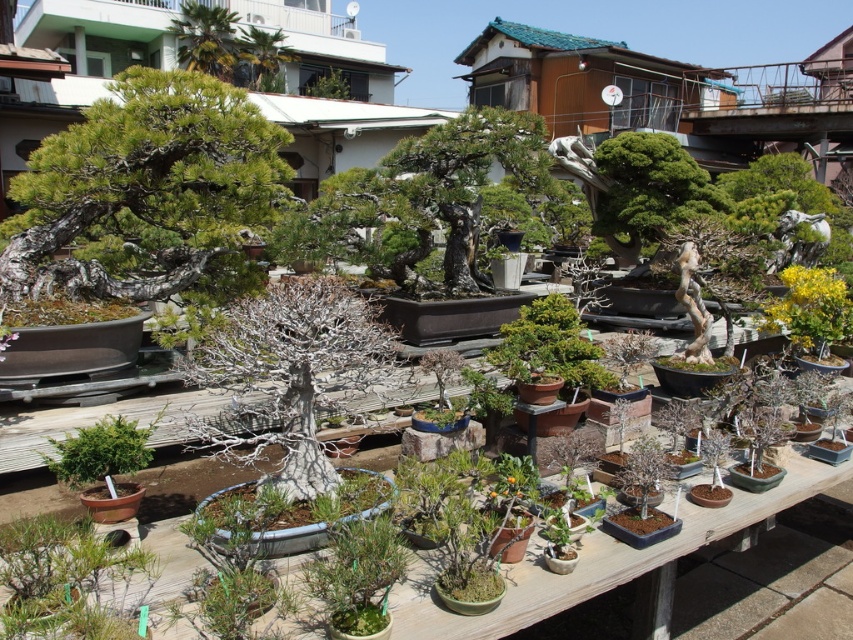
Question: Estimate the real-world distances between objects in this image. Which object is farther from the green matte bonsai tree at upper left?

Choices:
 (A) green glossy bonsai at upper right
 (B) green leafy tree at upper center

Answer: (B)

Question: Is green matte bonsai tree at upper left positioned before bare bark bonsai at center?

Choices:
 (A) no
 (B) yes

Answer: (A)

Question: Is bare bark bonsai at center thinner than green glossy bonsai at upper right?

Choices:
 (A) no
 (B) yes

Answer: (B)

Question: Which point is closer to the camera?

Choices:
 (A) (73, 141)
 (B) (277, 81)
 (C) (218, 32)

Answer: (A)

Question: Which of these objects is positioned farthest from the green leafy palm at upper center?

Choices:
 (A) green matte bonsai tree at center
 (B) green matte bonsai tree at upper left

Answer: (B)

Question: Can you confirm if bare bark bonsai at center is smaller than green leafy palm at upper center?

Choices:
 (A) no
 (B) yes

Answer: (B)